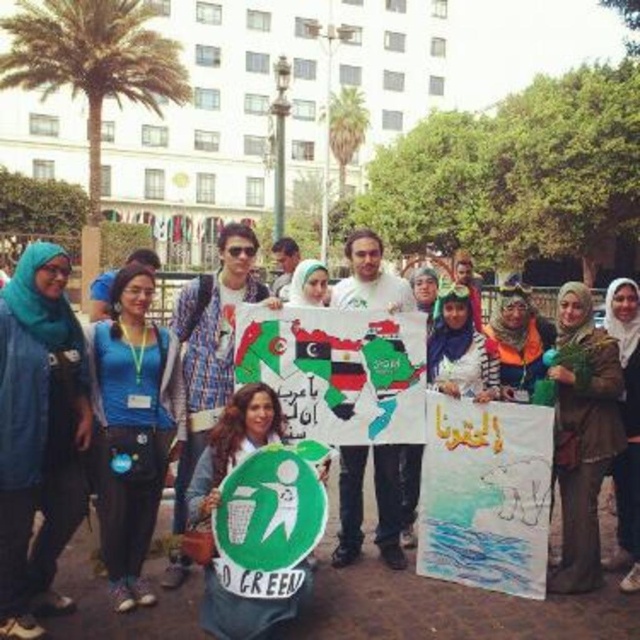
Question: Is white paper poster at center closer to camera compared to white paper map at center?

Choices:
 (A) no
 (B) yes

Answer: (B)

Question: Among these points, which one is nearest to the camera?

Choices:
 (A) 246,396
 (B) 45,621

Answer: (B)

Question: Is the position of green paper sign at center more distant than that of white paper map at center?

Choices:
 (A) no
 (B) yes

Answer: (A)

Question: Does blue fabric shirt at left have a lesser width compared to green matte sign at center?

Choices:
 (A) no
 (B) yes

Answer: (B)

Question: Which point is farther to the camera?

Choices:
 (A) (250, 432)
 (B) (122, 602)
 (C) (35, 355)

Answer: (A)

Question: Estimate the real-world distances between objects in this image. Which object is closer to the blue fabric shirt at left?

Choices:
 (A) green matte sign at center
 (B) white paper poster at center
 (C) green paper sign at center

Answer: (A)